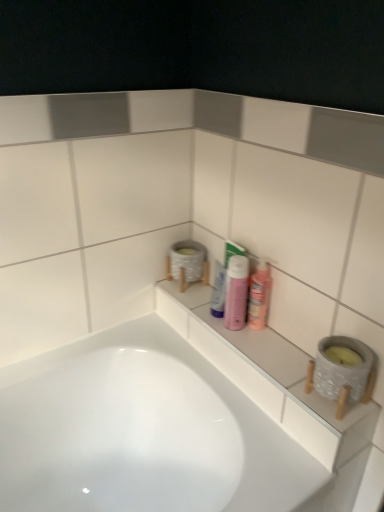
Question: From the image's perspective, is white glossy tube at center, the 1th mouthwash from the left, located above or below white ceramic ledge at center?

Choices:
 (A) below
 (B) above

Answer: (B)

Question: Looking at their shapes, would you say white glossy tube at center, marked as the second mouthwash in a right-to-left arrangement, is wider or thinner than white ceramic ledge at center?

Choices:
 (A) thin
 (B) wide

Answer: (A)

Question: Considering the real-world distances, which object is closest to the pink glossy mouthwash at center, arranged as the first mouthwash when viewed from the right?

Choices:
 (A) pink matte bottle at center
 (B) white ceramic ledge at center
 (C) white glossy tube at center, marked as the second mouthwash in a right-to-left arrangement

Answer: (A)

Question: Based on their relative distances, which object is farther from the white glossy tube at center, the 1th mouthwash from the left?

Choices:
 (A) white ceramic ledge at center
 (B) pink glossy mouthwash at center, which is the second mouthwash in left-to-right order
 (C) pink matte bottle at center

Answer: (A)